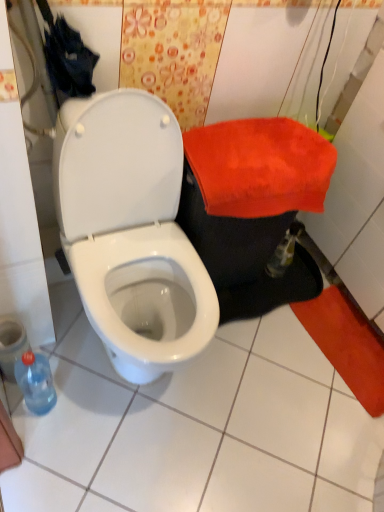
Question: From a real-world perspective, is white glossy toilet at center below red plush towel at right?

Choices:
 (A) yes
 (B) no

Answer: (A)

Question: Is white glossy toilet at center positioned far away from red plush towel at right?

Choices:
 (A) yes
 (B) no

Answer: (B)

Question: Does white glossy toilet at center have a lesser width compared to red plush towel at right?

Choices:
 (A) no
 (B) yes

Answer: (A)

Question: Is the position of white glossy toilet at center more distant than that of red plush towel at right?

Choices:
 (A) no
 (B) yes

Answer: (A)

Question: Is the depth of white glossy toilet at center less than that of red plush towel at right?

Choices:
 (A) no
 (B) yes

Answer: (B)

Question: Considering the relative positions of white glossy toilet at center and red plush towel at right in the image provided, is white glossy toilet at center to the right of red plush towel at right from the viewer's perspective?

Choices:
 (A) no
 (B) yes

Answer: (A)

Question: Is translucent plastic bottle at lower left positioned before white glossy toilet at center?

Choices:
 (A) yes
 (B) no

Answer: (B)

Question: Are translucent plastic bottle at lower left and white glossy toilet at center making contact?

Choices:
 (A) yes
 (B) no

Answer: (B)

Question: Does translucent plastic bottle at lower left come behind white glossy toilet at center?

Choices:
 (A) yes
 (B) no

Answer: (A)

Question: Can you confirm if translucent plastic bottle at lower left is thinner than white glossy toilet at center?

Choices:
 (A) no
 (B) yes

Answer: (B)

Question: Considering the relative sizes of translucent plastic bottle at lower left and white glossy toilet at center in the image provided, is translucent plastic bottle at lower left bigger than white glossy toilet at center?

Choices:
 (A) yes
 (B) no

Answer: (B)

Question: Considering the relative sizes of translucent plastic bottle at lower left and white glossy toilet at center in the image provided, is translucent plastic bottle at lower left taller than white glossy toilet at center?

Choices:
 (A) no
 (B) yes

Answer: (A)

Question: Could you tell me if red plush towel at right is facing translucent plastic bottle at lower left?

Choices:
 (A) yes
 (B) no

Answer: (B)